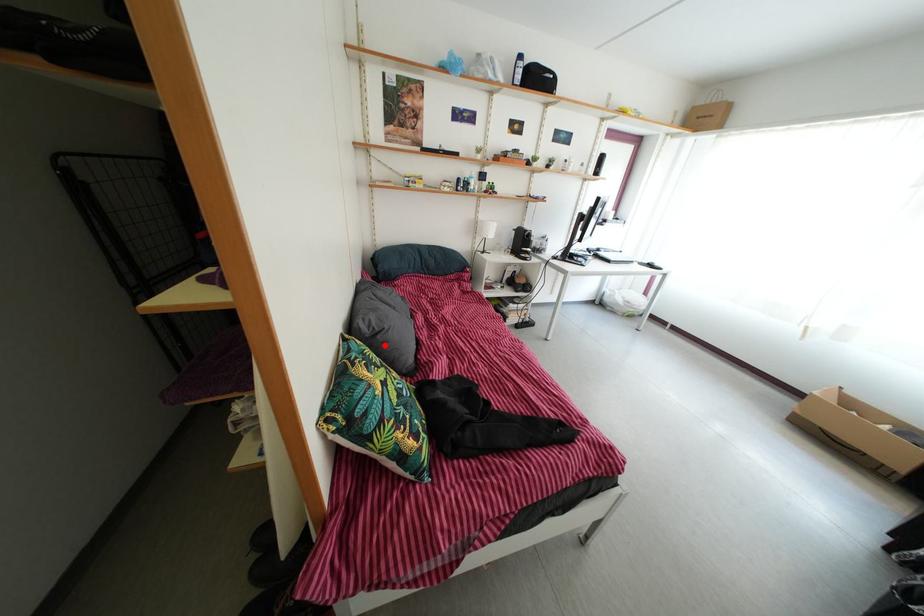
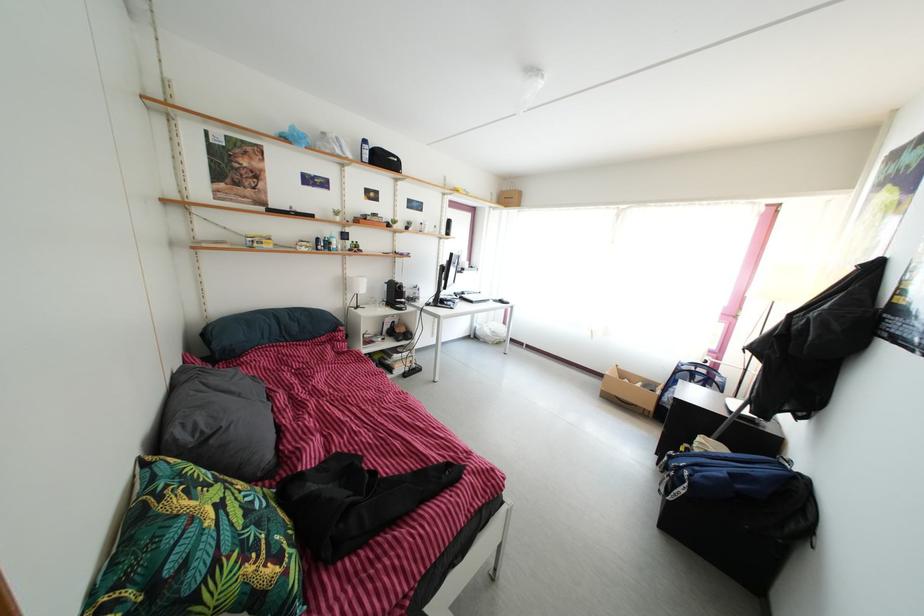
Locate, in the second image, the point that corresponds to the highlighted location in the first image.

(217, 450)